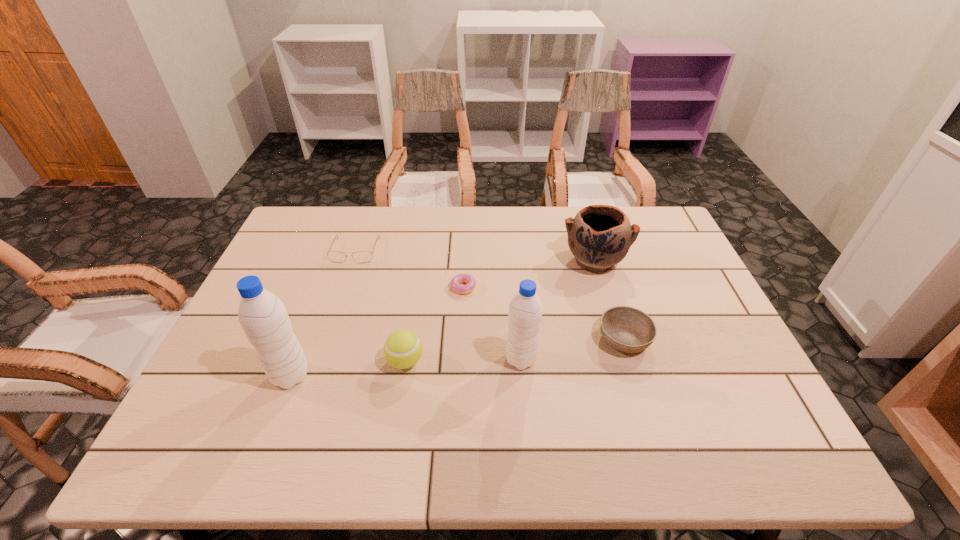
What are the coordinates of `tennis ball` in the screenshot? It's located at point(402,349).

This screenshot has width=960, height=540. In order to click on vacant region located 0.200m on the right of the left water bottle in this screenshot , I will do click(x=395, y=375).

You are a GUI agent. You are given a task and a screenshot of the screen. Output one action in this format:
    pyautogui.click(x=<x>, y=<y>)
    Task: Click on the free spot located 0.300m on the back of the second tallest object
    Image resolution: width=960 pixels, height=540 pixels.
    Given the screenshot: What is the action you would take?
    pyautogui.click(x=514, y=269)

The height and width of the screenshot is (540, 960). I want to click on blank space located on the right of the doughnut, so click(x=535, y=286).

Identify the location of vacant area situated 0.380m on the front-facing side of the sixth tallest object. pyautogui.click(x=317, y=365).

This screenshot has height=540, width=960. What are the coordinates of `blank space located 0.110m on the back of the pottery` in the screenshot? It's located at (584, 222).

Find the location of a particular element. vacant space located on the back of the bowl is located at coordinates (604, 274).

Locate an element on the screen. The width and height of the screenshot is (960, 540). vacant space located on the left of the tennis ball is located at coordinates (300, 361).

This screenshot has height=540, width=960. Identify the location of spectacles located at the far edge. (361, 256).

Where is `pottery that is at the far edge`? This screenshot has height=540, width=960. pottery that is at the far edge is located at coordinates coord(600,236).